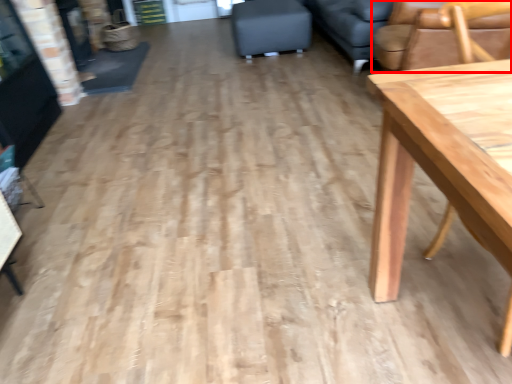
Question: Where is chair (annotated by the red box) located in relation to swivel chair in the image?

Choices:
 (A) left
 (B) right

Answer: (B)